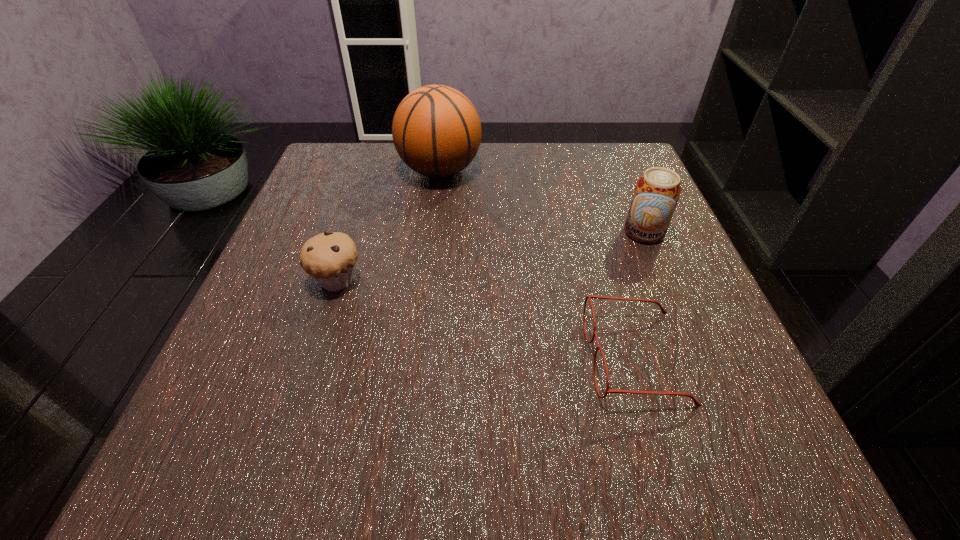
You are a GUI agent. You are given a task and a screenshot of the screen. Output one action in this format:
    pyautogui.click(x=<x>, y=<y>)
    Task: Click on the empty space between the third nearest object and the second shortest object
    This screenshot has width=960, height=540.
    Given the screenshot: What is the action you would take?
    click(491, 256)

Find the location of a particular element. This screenshot has width=960, height=540. vacant area between the third farthest object and the farthest object is located at coordinates (389, 225).

At what (x,y) coordinates should I click in order to perform the action: click on vacant point located between the beer can and the shortest object. Please return your answer as a coordinate pair (x, y). Image resolution: width=960 pixels, height=540 pixels. Looking at the image, I should click on (639, 295).

Where is `vacant area that lies between the second shortest object and the tallest object`? The image size is (960, 540). vacant area that lies between the second shortest object and the tallest object is located at coordinates (389, 225).

The image size is (960, 540). In order to click on vacant area that lies between the nearest object and the basketball in this screenshot , I will do `click(538, 264)`.

Where is `the closest object to the third object from right to left`? The width and height of the screenshot is (960, 540). the closest object to the third object from right to left is located at coordinates (329, 258).

Select which object appears as the third closest to the third object from right to left. Please provide its 2D coordinates. Your answer should be formatted as a tuple, i.e. [(x, y)], where the tuple contains the x and y coordinates of a point satisfying the conditions above.

[(697, 404)]